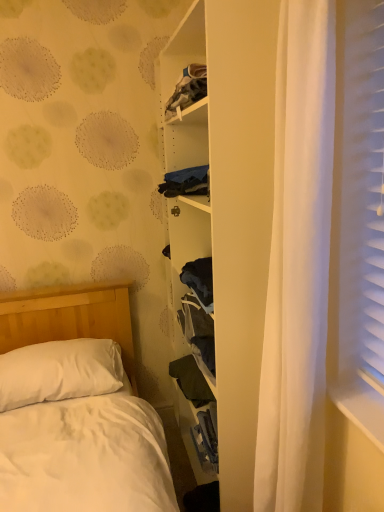
Question: Considering the relative positions of white soft pillow at lower left and dark green fabric at center in the image provided, is white soft pillow at lower left in front of dark green fabric at center?

Choices:
 (A) no
 (B) yes

Answer: (B)

Question: Could you tell me if white soft pillow at lower left is turned towards dark green fabric at center?

Choices:
 (A) yes
 (B) no

Answer: (B)

Question: Are white soft pillow at lower left and dark green fabric at center making contact?

Choices:
 (A) no
 (B) yes

Answer: (A)

Question: Is white soft pillow at lower left looking in the opposite direction of dark green fabric at center?

Choices:
 (A) no
 (B) yes

Answer: (A)

Question: Could dark green fabric at center be considered to be inside white soft pillow at lower left?

Choices:
 (A) yes
 (B) no

Answer: (B)

Question: Is white soft pillow at lower left taller or shorter than white matte bookshelf at center?

Choices:
 (A) tall
 (B) short

Answer: (B)

Question: From a real-world perspective, relative to white matte bookshelf at center, is white soft pillow at lower left vertically above or below?

Choices:
 (A) below
 (B) above

Answer: (A)

Question: Does point (64, 366) appear closer or farther from the camera than point (251, 114)?

Choices:
 (A) farther
 (B) closer

Answer: (A)

Question: Is white soft pillow at lower left wider or thinner than white matte bookshelf at center?

Choices:
 (A) wide
 (B) thin

Answer: (A)

Question: Considering the relative positions of dark green fabric at center and white soft pillow at lower left in the image provided, is dark green fabric at center to the left or to the right of white soft pillow at lower left?

Choices:
 (A) left
 (B) right

Answer: (B)

Question: From a real-world perspective, is dark green fabric at center physically located above or below white soft pillow at lower left?

Choices:
 (A) above
 (B) below

Answer: (B)

Question: Considering the positions of dark green fabric at center and white soft pillow at lower left in the image, is dark green fabric at center wider or thinner than white soft pillow at lower left?

Choices:
 (A) thin
 (B) wide

Answer: (A)

Question: In the image, is dark green fabric at center positioned in front of or behind white soft pillow at lower left?

Choices:
 (A) behind
 (B) front

Answer: (A)

Question: Is white matte bookshelf at center to the left or to the right of dark green fabric at center in the image?

Choices:
 (A) left
 (B) right

Answer: (B)

Question: In terms of size, does white matte bookshelf at center appear bigger or smaller than dark green fabric at center?

Choices:
 (A) big
 (B) small

Answer: (A)